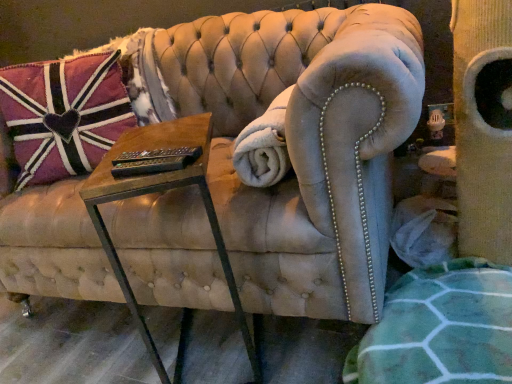
Question: Can you confirm if white fluffy blanket at center is taller than pink fabric pillow at upper left?

Choices:
 (A) no
 (B) yes

Answer: (A)

Question: Is white fluffy blanket at center behind pink fabric pillow at upper left?

Choices:
 (A) yes
 (B) no

Answer: (B)

Question: Can you see white fluffy blanket at center touching pink fabric pillow at upper left?

Choices:
 (A) yes
 (B) no

Answer: (B)

Question: Considering the relative sizes of white fluffy blanket at center and pink fabric pillow at upper left in the image provided, is white fluffy blanket at center shorter than pink fabric pillow at upper left?

Choices:
 (A) yes
 (B) no

Answer: (A)

Question: From a real-world perspective, is white fluffy blanket at center under pink fabric pillow at upper left?

Choices:
 (A) yes
 (B) no

Answer: (A)

Question: Is white fluffy blanket at center outside of pink fabric pillow at upper left?

Choices:
 (A) yes
 (B) no

Answer: (A)

Question: Can you confirm if white fluffy blanket at center is positioned to the right of woodenmaterial/texturetable at center?

Choices:
 (A) no
 (B) yes

Answer: (B)

Question: Is white fluffy blanket at center surrounding woodenmaterial/texturetable at center?

Choices:
 (A) yes
 (B) no

Answer: (B)

Question: From the image's perspective, would you say white fluffy blanket at center is shown under woodenmaterial/texturetable at center?

Choices:
 (A) yes
 (B) no

Answer: (B)

Question: From the image's perspective, does white fluffy blanket at center appear higher than woodenmaterial/texturetable at center?

Choices:
 (A) no
 (B) yes

Answer: (B)

Question: Is white fluffy blanket at center positioned before woodenmaterial/texturetable at center?

Choices:
 (A) yes
 (B) no

Answer: (B)

Question: From a real-world perspective, is white fluffy blanket at center below woodenmaterial/texturetable at center?

Choices:
 (A) no
 (B) yes

Answer: (A)

Question: Is pink fabric pillow at upper left thinner than woodenmaterial/texturetable at center?

Choices:
 (A) no
 (B) yes

Answer: (B)